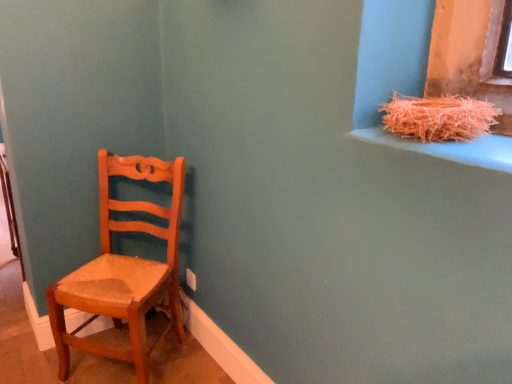
Question: Is wooden chair at left outside orange shredded straw at upper right?

Choices:
 (A) yes
 (B) no

Answer: (A)

Question: From the image's perspective, is wooden chair at left located above orange shredded straw at upper right?

Choices:
 (A) yes
 (B) no

Answer: (B)

Question: Is orange shredded straw at upper right inside wooden chair at left?

Choices:
 (A) yes
 (B) no

Answer: (B)

Question: From a real-world perspective, does wooden chair at left sit lower than orange shredded straw at upper right?

Choices:
 (A) no
 (B) yes

Answer: (B)

Question: Can you confirm if wooden chair at left is wider than orange shredded straw at upper right?

Choices:
 (A) yes
 (B) no

Answer: (A)

Question: Is the depth of wooden chair at left less than that of orange shredded straw at upper right?

Choices:
 (A) yes
 (B) no

Answer: (B)

Question: Is wooden chair at left at the back of orange shredded straw at upper right?

Choices:
 (A) yes
 (B) no

Answer: (B)

Question: Is orange shredded straw at upper right behind wooden chair at left?

Choices:
 (A) yes
 (B) no

Answer: (B)

Question: Is orange shredded straw at upper right oriented towards wooden chair at left?

Choices:
 (A) yes
 (B) no

Answer: (B)

Question: Can you confirm if orange shredded straw at upper right is shorter than wooden chair at left?

Choices:
 (A) no
 (B) yes

Answer: (B)

Question: Is orange shredded straw at upper right surrounding wooden chair at left?

Choices:
 (A) yes
 (B) no

Answer: (B)

Question: Can you confirm if orange shredded straw at upper right is positioned to the right of wooden chair at left?

Choices:
 (A) no
 (B) yes

Answer: (B)

Question: From a real-world perspective, is orange shredded straw at upper right physically located above or below wooden chair at left?

Choices:
 (A) above
 (B) below

Answer: (A)